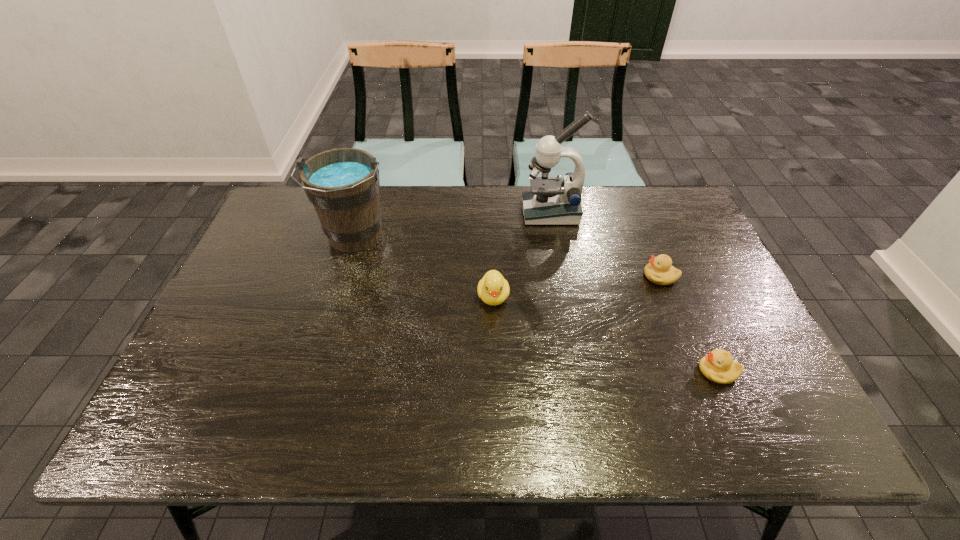
Where is `the tallest object`? The width and height of the screenshot is (960, 540). the tallest object is located at coordinates (552, 201).

The width and height of the screenshot is (960, 540). What are the coordinates of `the third object from left to right` in the screenshot? It's located at (552, 201).

The width and height of the screenshot is (960, 540). Find the location of `the fourth shortest object`. the fourth shortest object is located at coordinates 343,184.

You are a GUI agent. You are given a task and a screenshot of the screen. Output one action in this format:
    pyautogui.click(x=<x>, y=<y>)
    Task: Click on the leftmost object
    This screenshot has height=540, width=960.
    Given the screenshot: What is the action you would take?
    pyautogui.click(x=343, y=184)

Identify the location of the third tallest object. This screenshot has height=540, width=960. (493, 289).

Identify the location of the leftmost duckling. Image resolution: width=960 pixels, height=540 pixels. (493, 289).

The height and width of the screenshot is (540, 960). Find the location of `the nearest duckling`. the nearest duckling is located at coordinates (718, 366).

Where is `vacant space located on the right of the tallest object`? vacant space located on the right of the tallest object is located at coordinates (684, 213).

Find the location of a particular element. Image resolution: width=960 pixels, height=540 pixels. free spot located with a handle on the side of the leftmost object is located at coordinates (319, 359).

In order to click on vacant space located on the beak of the tallest duckling in this screenshot , I will do pyautogui.click(x=496, y=397).